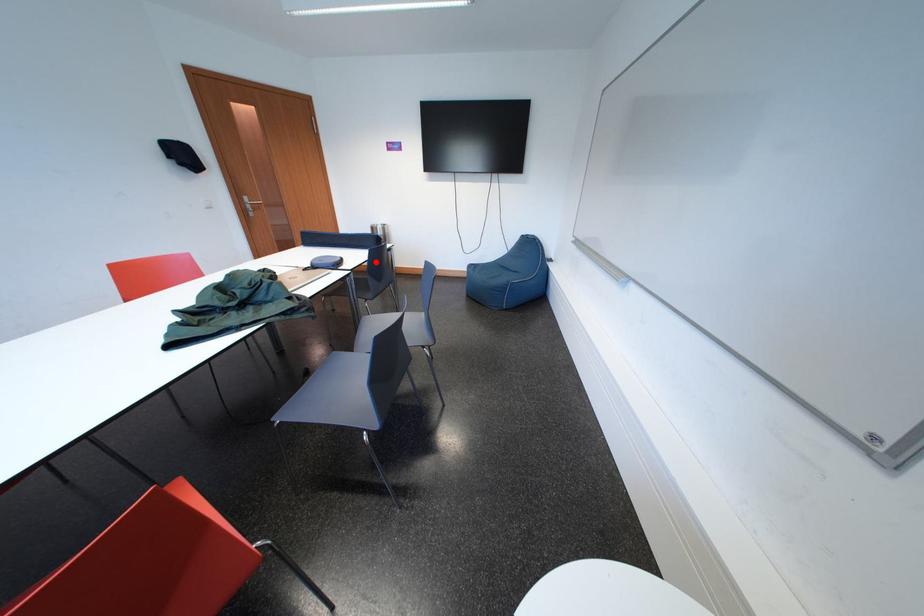
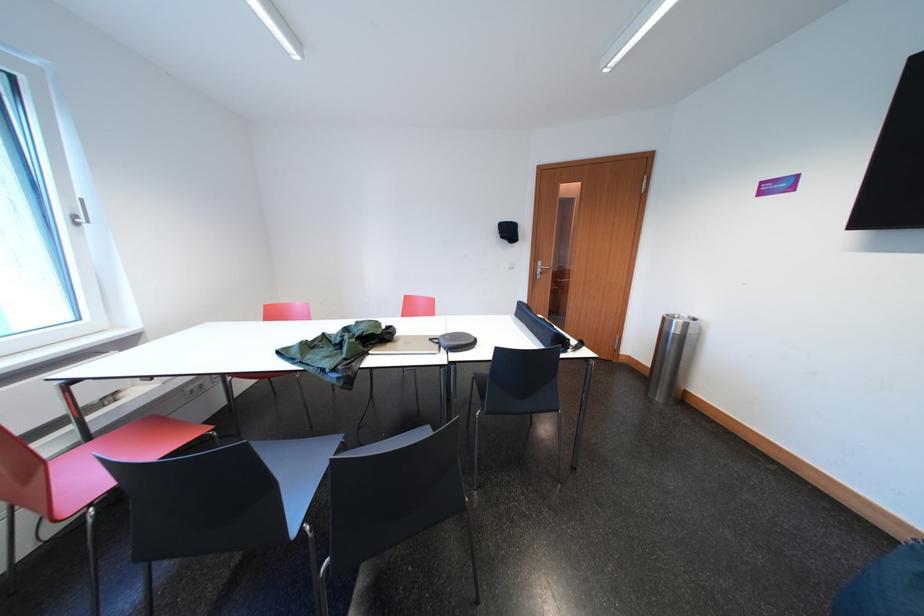
Question: I am providing you with two images of the same scene from different viewpoints. A red point is shown in image1. For the corresponding object point in image2, is it positioned nearer or farther from the camera?

Choices:
 (A) Nearer
 (B) Farther

Answer: (B)